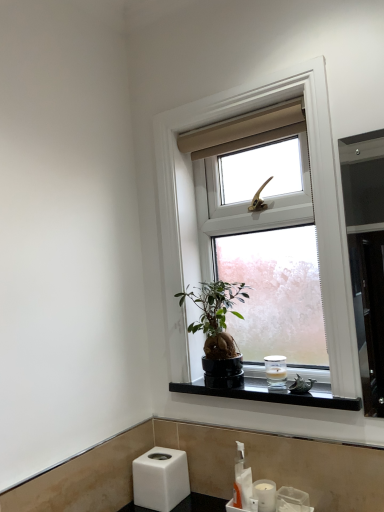
Image resolution: width=384 pixels, height=512 pixels. Describe the element at coordinates (301, 385) in the screenshot. I see `metallic silver bird at window` at that location.

In order to face metallic silver bird at window, should I rotate leftwards or rightwards?

Rotate right and turn 14.386 degrees.

Describe the element at coordinates (242, 480) in the screenshot. Image resolution: width=384 pixels, height=512 pixels. I see `white plastic soap dispenser at lower center` at that location.

What do you see at coordinates (265, 495) in the screenshot?
I see `white matte candle at lower right, the 1th toiletry when ordered from front to back` at bounding box center [265, 495].

Measure the distance between point (224, 379) and camera.

Point (224, 379) is 1.44 meters away from camera.

This screenshot has height=512, width=384. Describe the element at coordinates (218, 331) in the screenshot. I see `green matte houseplant at center` at that location.

The width and height of the screenshot is (384, 512). Find the location of `matte white window at center`. matte white window at center is located at coordinates pyautogui.click(x=313, y=206).

Looking at this image, from the image's perspective, does green matte houseplant at center appear higher than metallic silver bird at window?

Yes, from the image's perspective, green matte houseplant at center is over metallic silver bird at window.

Is green matte houseplant at center beside metallic silver bird at window?

green matte houseplant at center and metallic silver bird at window are clearly separated.

Can we say green matte houseplant at center lies outside metallic silver bird at window?

That's correct, green matte houseplant at center is outside of metallic silver bird at window.

From a real-world perspective, who is located lower, white matte candle at lower right, which is the first toiletry in bottom-to-top order, or white glossy sink at lower center?

white glossy sink at lower center is physically lower.

Is white matte candle at lower right, the 1th toiletry when ordered from front to back, positioned beyond the bounds of white glossy sink at lower center?

Actually, white matte candle at lower right, the 1th toiletry when ordered from front to back, is within white glossy sink at lower center.

Does white matte candle at lower right, the 1th toiletry when ordered from front to back, have a lesser width compared to white glossy sink at lower center?

Indeed, white matte candle at lower right, the 1th toiletry when ordered from front to back, has a lesser width compared to white glossy sink at lower center.

Consider the image. Considering the sizes of objects black polished stone at lower center and green matte houseplant at center in the image provided, who is bigger, black polished stone at lower center or green matte houseplant at center?

With larger size is green matte houseplant at center.

Between black polished stone at lower center and green matte houseplant at center, which one has more height?

With more height is green matte houseplant at center.

The height and width of the screenshot is (512, 384). I want to click on window sill below the green matte houseplant at center (from a real-world perspective), so click(272, 394).

From a real-world perspective, between white plastic soap dispenser at lower center and white frosted glass candle at lower right, the 1th toiletry from the top, who is vertically lower?

white plastic soap dispenser at lower center, from a real-world perspective.

From the image's perspective, does white plastic soap dispenser at lower center appear higher than white frosted glass candle at lower right, positioned as the second toiletry in bottom-to-top order?

No, from the image's perspective, white plastic soap dispenser at lower center is not above white frosted glass candle at lower right, positioned as the second toiletry in bottom-to-top order.

Does white plastic soap dispenser at lower center turn towards white frosted glass candle at lower right, the 1th toiletry from the top?

No.

Visually, is white plastic soap dispenser at lower center positioned to the left or to the right of white frosted glass candle at lower right, positioned as the first toiletry in back-to-front order?

Clearly, white plastic soap dispenser at lower center is on the left of white frosted glass candle at lower right, positioned as the first toiletry in back-to-front order, in the image.

Which point is more distant from viewer, (172, 331) or (255, 489)?

The point (172, 331) is farther.

Would you consider matte white window at center to be distant from white matte candle at lower right, which is the second toiletry from top to bottom?

No, matte white window at center is not far from white matte candle at lower right, which is the second toiletry from top to bottom.

Is matte white window at center bigger than white matte candle at lower right, the 1th toiletry when ordered from front to back?

Yes.

From the image's perspective, which one is positioned higher, matte white window at center or white matte candle at lower right, the second toiletry from the back?

From the image's view, matte white window at center is above.

Considering the relative sizes of metallic silver bird at window and white frosted glass candle at lower right, the 1th toiletry from the top, in the image provided, is metallic silver bird at window bigger than white frosted glass candle at lower right, the 1th toiletry from the top,?

No.

Considering the points (294, 380) and (283, 377), which point is in front, point (294, 380) or point (283, 377)?

The point (294, 380) is in front.

Between metallic silver bird at window and white frosted glass candle at lower right, positioned as the second toiletry in bottom-to-top order, which one has less height?

metallic silver bird at window is shorter.

Is metallic silver bird at window far away from white frosted glass candle at lower right, acting as the second toiletry starting from the front?

metallic silver bird at window is near white frosted glass candle at lower right, acting as the second toiletry starting from the front, not far away.

Is metallic silver bird at window spatially inside white glossy sink at lower center, or outside of it?

metallic silver bird at window is not enclosed by white glossy sink at lower center.

Is metallic silver bird at window bigger or smaller than white glossy sink at lower center?

Clearly, metallic silver bird at window is smaller in size than white glossy sink at lower center.

How different are the orientations of metallic silver bird at window and white glossy sink at lower center in degrees?

The angular difference between metallic silver bird at window and white glossy sink at lower center is 2.43 degrees.

Is metallic silver bird at window looking in the opposite direction of white glossy sink at lower center?

No, metallic silver bird at window's orientation is not away from white glossy sink at lower center.

The height and width of the screenshot is (512, 384). In the image, there is a green matte houseplant at center. Identify the location of bird below it (from a real-world perspective). (301, 385).

Image resolution: width=384 pixels, height=512 pixels. What are the coordinates of `toiletry on the left of white glossy sink at lower center` in the screenshot? It's located at (265, 495).

In the scene shown: When comparing their distances from black polished stone at lower center, does metallic silver bird at window or white plastic soap dispenser at lower center seem closer?

Among the two, metallic silver bird at window is located nearer to black polished stone at lower center.

Which object lies nearer to the anchor point white frosted glass candle at lower right, positioned as the first toiletry in back-to-front order, white glossy sink at lower center or green matte houseplant at center?

The object closer to white frosted glass candle at lower right, positioned as the first toiletry in back-to-front order, is green matte houseplant at center.

From the image, which object appears to be nearer to black polished stone at lower center, metallic silver bird at window or white glossy sink at lower center?

metallic silver bird at window is closer to black polished stone at lower center.

Which object lies nearer to the anchor point white matte candle at lower right, the second toiletry from the back, white frosted glass candle at lower right, acting as the second toiletry starting from the front, or metallic silver bird at window?

metallic silver bird at window is closer to white matte candle at lower right, the second toiletry from the back.

Based on their spatial positions, is metallic silver bird at window or black polished stone at lower center closer to white glossy sink at lower center?

Based on the image, black polished stone at lower center appears to be nearer to white glossy sink at lower center.

Which object lies further to the anchor point green matte houseplant at center, white glossy sink at lower center or white frosted glass candle at lower right, acting as the second toiletry starting from the front?

white glossy sink at lower center is positioned further to the anchor green matte houseplant at center.

Estimate the real-world distances between objects in this image. Which object is further from white glossy sink at lower center, matte white window at center or white matte candle at lower right, which is the second toiletry from top to bottom?

matte white window at center is further to white glossy sink at lower center.

Based on their spatial positions, is white plastic soap dispenser at lower center or white glossy sink at lower center closer to black polished stone at lower center?

Based on the image, white plastic soap dispenser at lower center appears to be nearer to black polished stone at lower center.

You are a GUI agent. You are given a task and a screenshot of the screen. Output one action in this format:
    pyautogui.click(x=<x>, y=<y>)
    Task: Click on the houseplant between matte white window at center and white frosted glass candle at lower right, acting as the second toiletry starting from the front, from top to bottom
    
    Given the screenshot: What is the action you would take?
    pyautogui.click(x=218, y=331)

Locate an element on the screen. The width and height of the screenshot is (384, 512). window sill situated between green matte houseplant at center and white frosted glass candle at lower right, positioned as the first toiletry in back-to-front order, from left to right is located at coordinates (272, 394).

At what (x,y) coordinates should I click in order to perform the action: click on bird between green matte houseplant at center and white matte candle at lower right, which is the second toiletry from top to bottom, in the up-down direction. Please return your answer as a coordinate pair (x, y). This screenshot has height=512, width=384. Looking at the image, I should click on (301, 385).

Where is `houseplant between matte white window at center and white glossy sink at lower center from top to bottom`? houseplant between matte white window at center and white glossy sink at lower center from top to bottom is located at coordinates (218, 331).